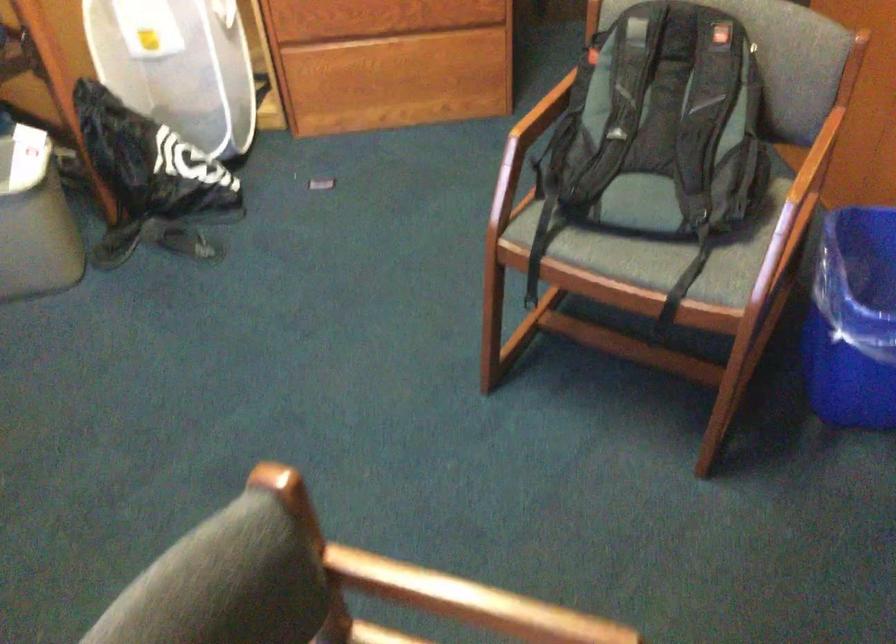
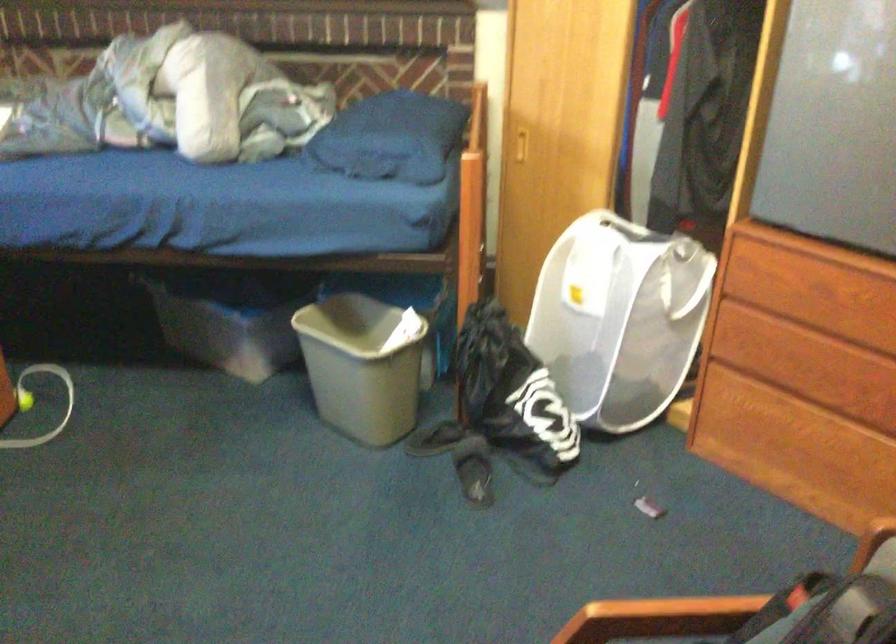
Question: How did the camera likely rotate?

Choices:
 (A) Left
 (B) Right
 (C) Up
 (D) Down

Answer: (A)